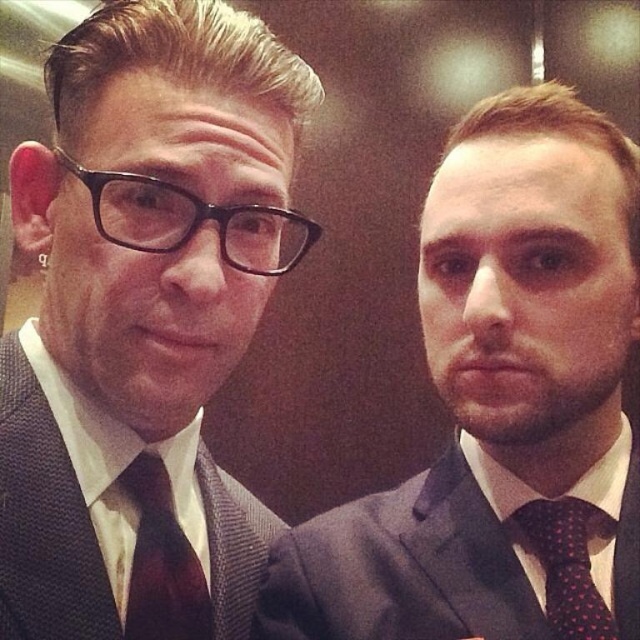
Based on the photo, you are standing in an elevator and see two points marked on the wall. The first point is at coordinates point (64, 444) and the second point is at point (577, 621). Which point is closer to you?

Point (64, 444) is closer to the camera than point (577, 621), so the first point is closer to you.

You are a tailor measuring two items for alterations. You have a dark brown textured suit at left and a dark brown textured tie at left. Which item requires more fabric to adjust for a better fit?

The dark brown textured suit at left requires more fabric because it is larger in size compared to the dark brown textured tie at left.

Based on the scene description, what does the point at coordinate (x=44, y=522) represent?

The point at coordinate (x=44, y=522) represents the location of the dark brown textured suit at left.